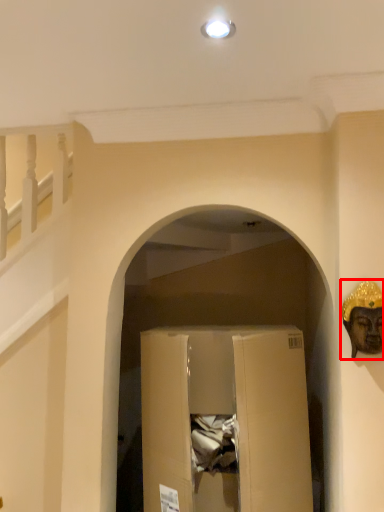
Question: In this image, where is construction worker (annotated by the red box) located relative to cardboard box?

Choices:
 (A) left
 (B) right

Answer: (B)